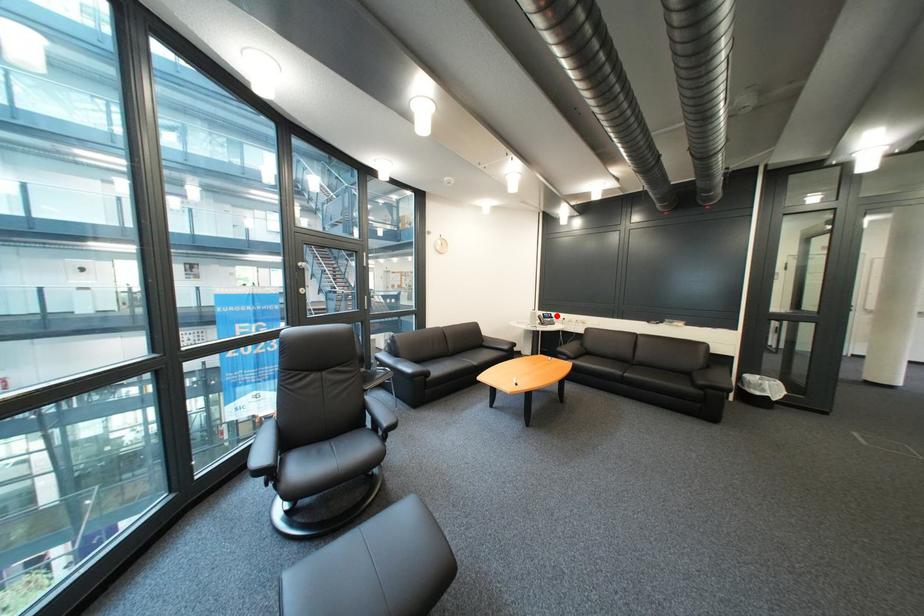
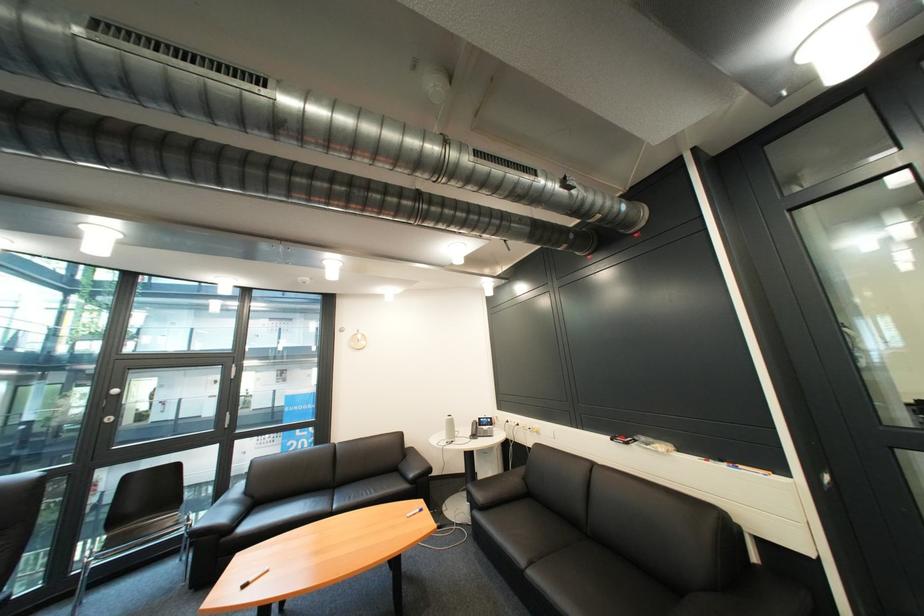
Locate, in the second image, the point that corresponds to the highlighted location in the first image.

(492, 419)